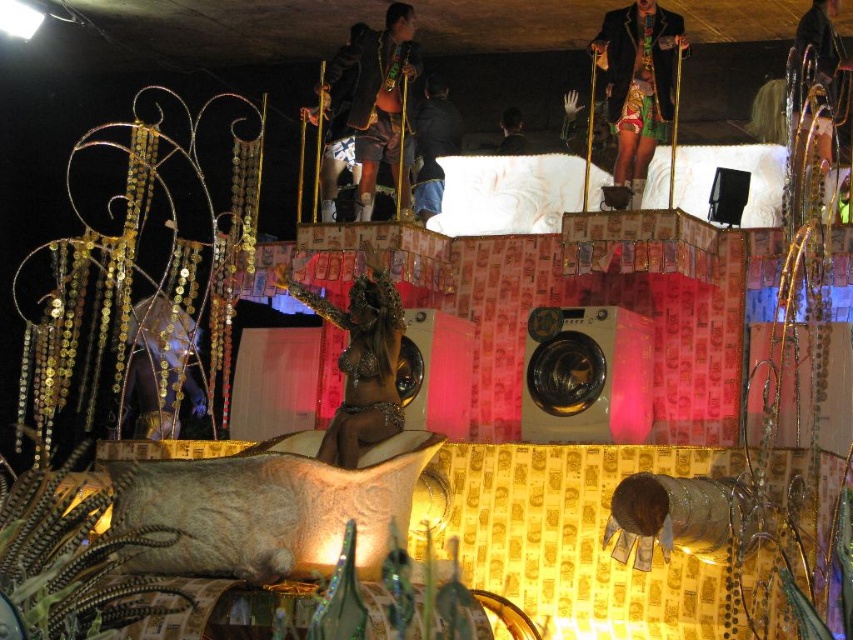
Does point (648, 13) come closer to viewer compared to point (520, 115)?

Yes, point (648, 13) is closer to viewer.

Does shiny metallic jacket at upper center have a lesser height compared to smooth skin figure at center?

No, shiny metallic jacket at upper center is not shorter than smooth skin figure at center.

Is point (666, 48) closer to viewer compared to point (509, 154)?

Yes, point (666, 48) is in front of point (509, 154).

Identify the location of shiny metallic jacket at upper center. This screenshot has height=640, width=853. (637, 81).

Consider the image. Between shiny gold statue at center and shiny metallic jacket at upper center, which one is positioned higher?

Positioned higher is shiny metallic jacket at upper center.

Who is taller, shiny gold statue at center or shiny metallic jacket at upper center?

With more height is shiny metallic jacket at upper center.

You are a GUI agent. You are given a task and a screenshot of the screen. Output one action in this format:
    pyautogui.click(x=<x>, y=<y>)
    Task: Click on the shiny gold statue at center
    
    Given the screenshot: What is the action you would take?
    361,362

Where is `shiny gold statue at center`? This screenshot has width=853, height=640. shiny gold statue at center is located at coordinates (361, 362).

Is shiny gold statue at center in front of smooth skin figure at center?

Yes, it is in front of smooth skin figure at center.

Does shiny gold statue at center have a greater height compared to smooth skin figure at center?

Indeed, shiny gold statue at center has a greater height compared to smooth skin figure at center.

Between point (315, 301) and point (502, 147), which one is positioned behind?

Positioned behind is point (502, 147).

Locate an element on the screen. shiny gold statue at center is located at coordinates (361, 362).